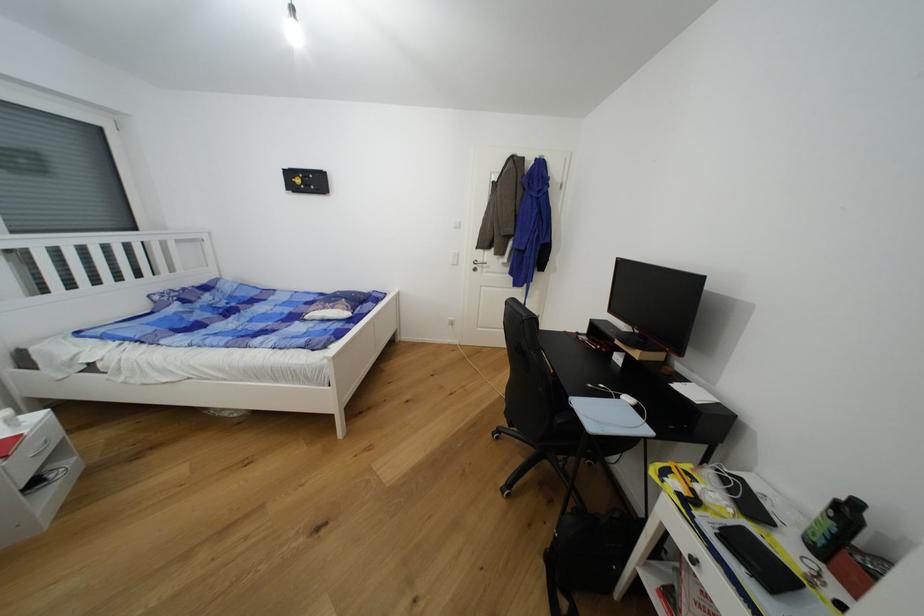
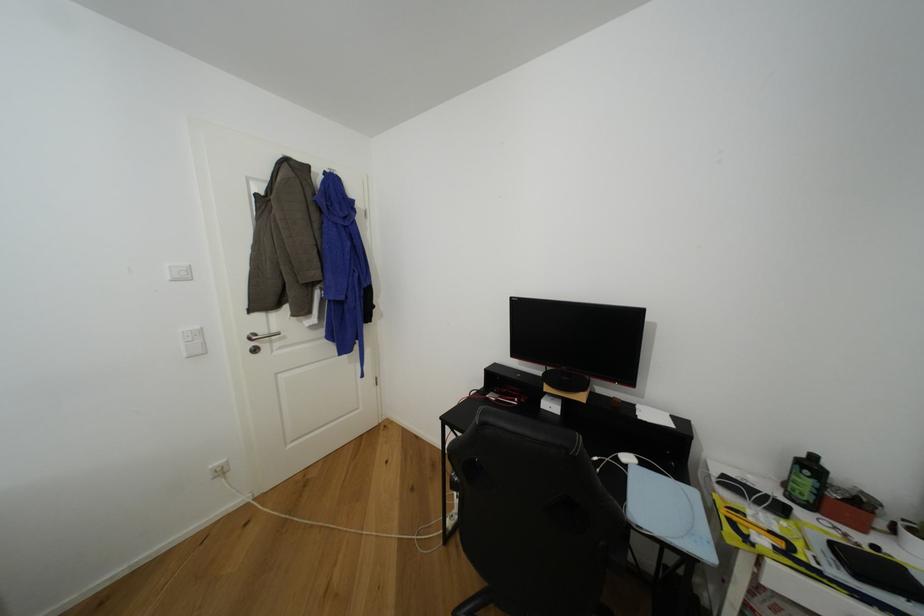
Question: The camera is either moving clockwise (left) or counter-clockwise (right) around the object. The first image is from the beginning of the video and the second image is from the end. Is the camera moving left or right when shooting the video?

Choices:
 (A) Left
 (B) Right

Answer: (A)